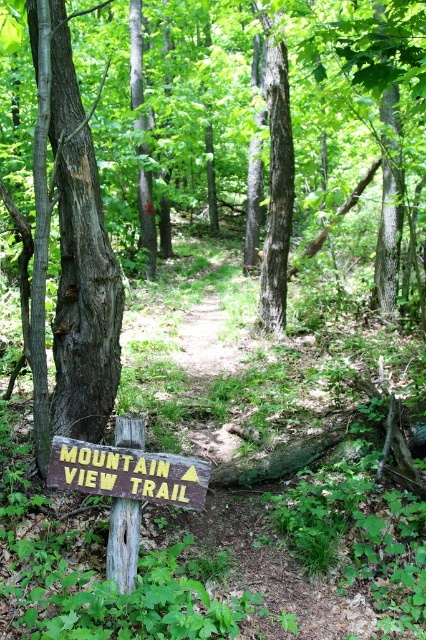
Is brown wooden sign at lower center further to camera compared to weathered brown signpost at lower left?

No, brown wooden sign at lower center is in front of weathered brown signpost at lower left.

Between brown wooden sign at lower center and weathered brown signpost at lower left, which one appears on the left side from the viewer's perspective?

Positioned to the left is weathered brown signpost at lower left.

Measure the distance between point [138,477] and camera.

Point [138,477] is 2.91 meters from camera.

Locate an element on the screen. The width and height of the screenshot is (426, 640). brown wooden sign at lower center is located at coordinates (127, 472).